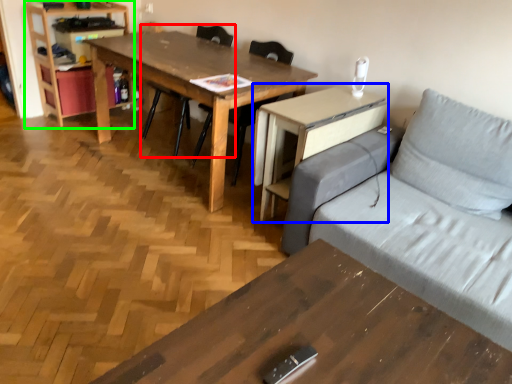
Question: Which is farther away from chair (highlighted by a red box)? computer desk (highlighted by a blue box) or bookshelf (highlighted by a green box)?

Choices:
 (A) computer desk
 (B) bookshelf

Answer: (A)